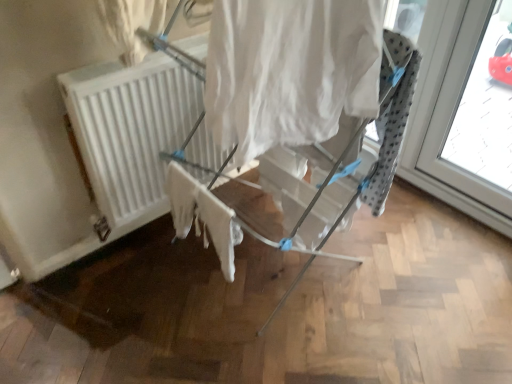
Find the location of a particular element. This screenshot has width=512, height=384. vacant area that is in front of white fabric drying rack at center is located at coordinates (253, 342).